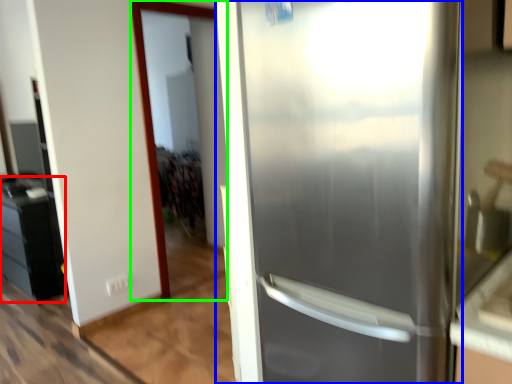
Question: Which object is positioned closest to cabinetry (highlighted by a red box)? Select from refrigerator (highlighted by a blue box) and screen door (highlighted by a green box).

Choices:
 (A) refrigerator
 (B) screen door

Answer: (B)